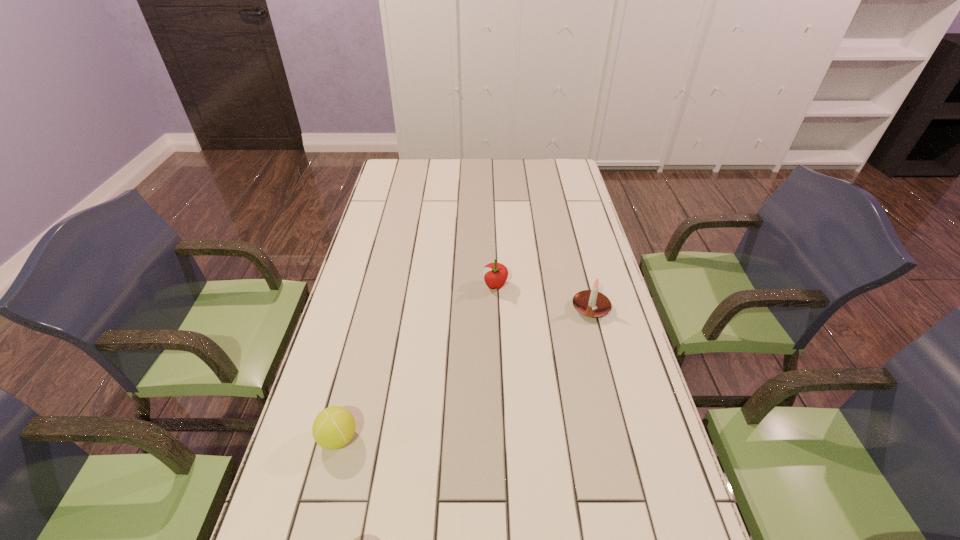
Locate an element on the screen. The width and height of the screenshot is (960, 540). the tallest object is located at coordinates (591, 303).

Locate an element on the screen. candle is located at coordinates 591,303.

Locate an element on the screen. Image resolution: width=960 pixels, height=540 pixels. the second object from right to left is located at coordinates (495, 274).

Find the location of a particular element. Image resolution: width=960 pixels, height=540 pixels. apple is located at coordinates (495, 274).

The width and height of the screenshot is (960, 540). Identify the location of tennis ball. (334, 427).

Identify the location of the leftmost object. (334, 427).

Find the location of a particular element. free spot located 0.150m on the left of the second farthest object is located at coordinates (524, 308).

Where is `vacant space located 0.180m on the right of the second object from right to left`? This screenshot has height=540, width=960. vacant space located 0.180m on the right of the second object from right to left is located at coordinates (563, 286).

This screenshot has width=960, height=540. I want to click on vacant space situated 0.300m on the right of the tennis ball, so click(x=484, y=438).

Identify the location of object located at the left edge. The width and height of the screenshot is (960, 540). (334, 427).